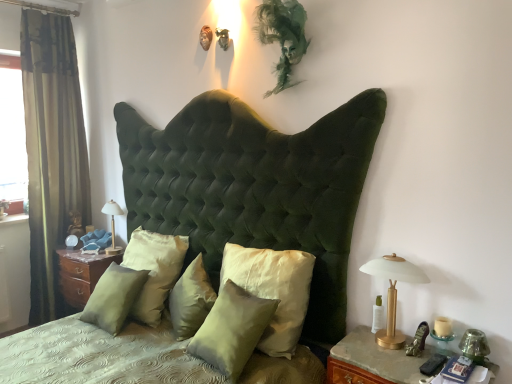
Question: Is transparent glass window at left inside or outside of green velvet curtain at left?

Choices:
 (A) inside
 (B) outside

Answer: (B)

Question: Is transparent glass window at left to the left or to the right of green velvet curtain at left in the image?

Choices:
 (A) left
 (B) right

Answer: (A)

Question: Which object is the closest to the wooden nightstand at lower right, the 2th nightstand when ordered from back to front?

Choices:
 (A) gold metallic bedside lamp at right, which ranks as the 1th bedside lamp in right-to-left order
 (B) green velvet curtain at left
 (C) satin/velvet pillow at center, which ranks as the 2th pillow in left-to-right order
 (D) satin wood nightstand at lower left, marked as the second nightstand in a front-to-back arrangement
 (E) transparent glass window at left

Answer: (A)

Question: Which of these objects is positioned closest to the transparent glass window at left?

Choices:
 (A) satin wood nightstand at lower left, marked as the second nightstand in a front-to-back arrangement
 (B) satin green pillow at center, the 5th pillow positioned from the right
 (C) wooden nightstand at lower right, the 2th nightstand when ordered from left to right
 (D) satin green pillow at center, the 3th pillow from the right
 (E) gold metallic bedside lamp at right, which is counted as the second bedside lamp, starting from the left

Answer: (A)